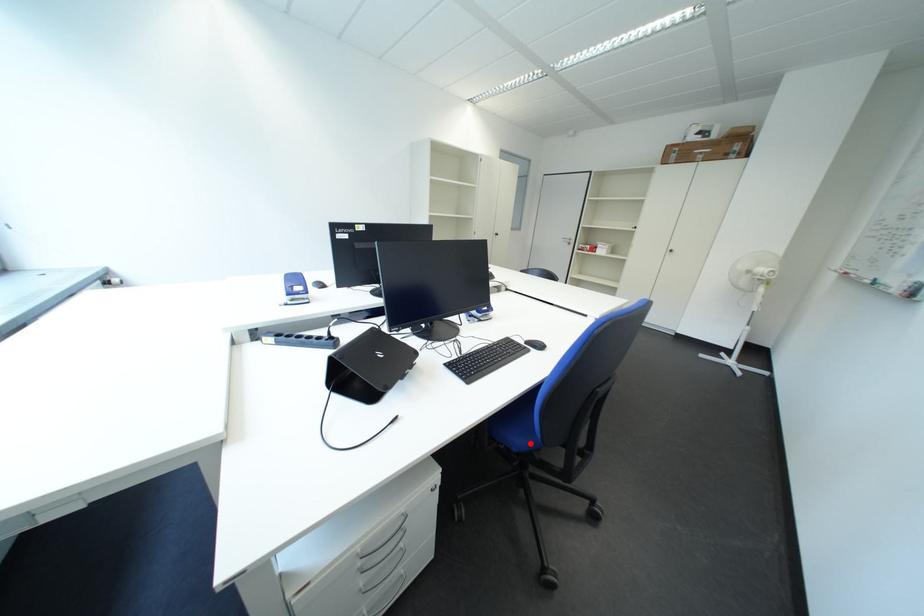
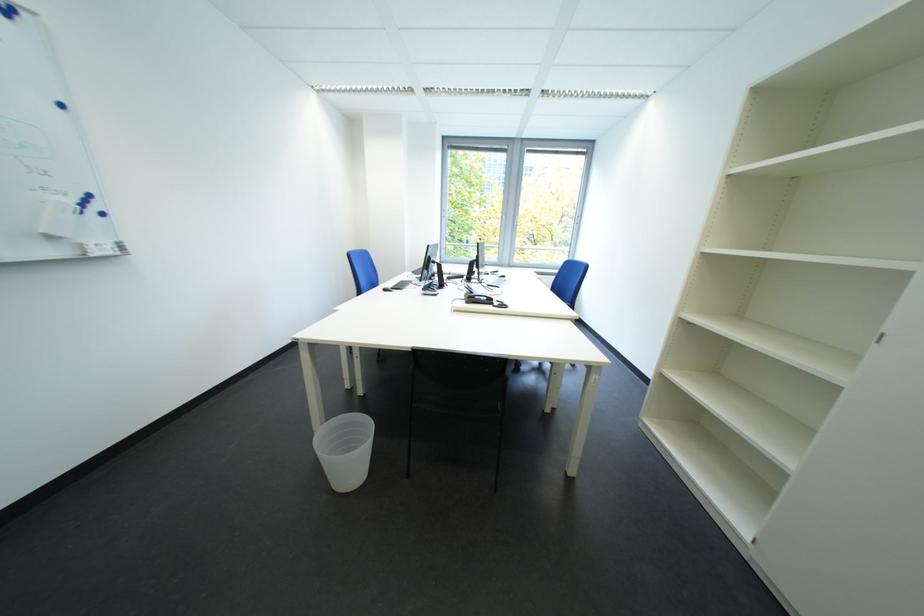
Question: I am providing you with two images of the same scene from different viewpoints. A red point is marked on the first image. At the location where the point appears in image 1, is it still visible in image 2?

Choices:
 (A) Yes
 (B) No

Answer: (B)